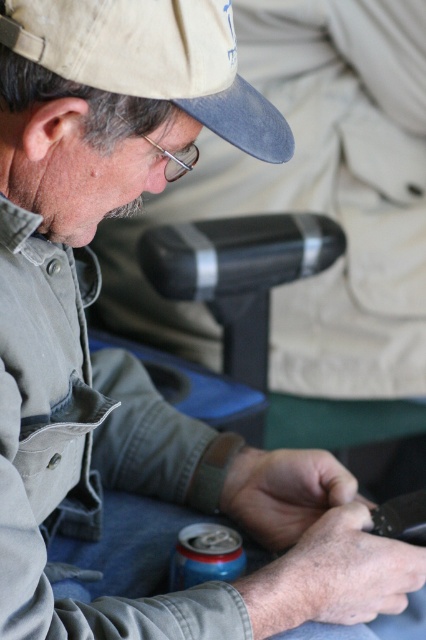
From the picture: Does matte khaki cap at upper left have a smaller size compared to beige fabric cap at upper left?

No.

Between point (417, 276) and point (141, 49), which one is positioned in front?

Positioned in front is point (141, 49).

Is point (347, 88) less distant than point (181, 92)?

No, (347, 88) is further to viewer.

I want to click on matte khaki cap at upper left, so click(311, 200).